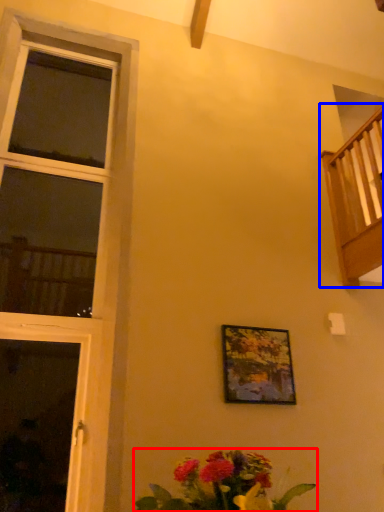
Question: Among these objects, which one is farthest to the camera, floral arrangement (highlighted by a red box) or balcony (highlighted by a blue box)?

Choices:
 (A) floral arrangement
 (B) balcony

Answer: (B)